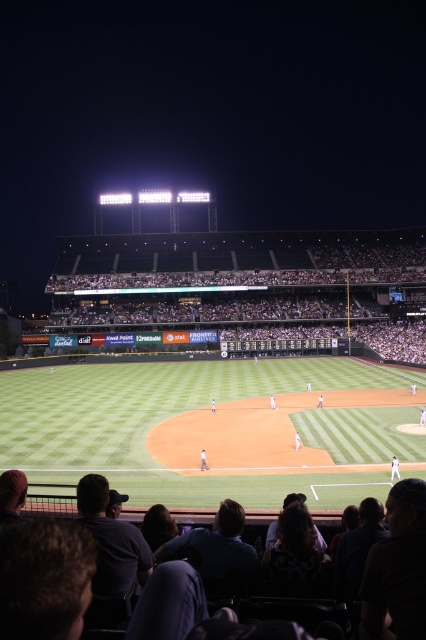
You are a photographer standing at the edge of the baseball field. You want to take a photo that includes both the dark fabric seats at lower center and the white fabric shirt at center. Based on their positions, which object should appear closer to the bottom of the photo?

The dark fabric seats at lower center are positioned above the white fabric shirt at center, so in the photo, the white fabric shirt at center will appear closer to the bottom of the photo.

You are a photographer standing at the edge of the baseball field. You want to take a photo that includes both the dark fabric seats at lower center and the white fabric shirt at center. Which object will appear taller in the photo?

The white fabric shirt at center will appear taller in the photo because the dark fabric seats at lower center has a lesser height compared to it.

You are a photographer standing in the stands of the baseball stadium. You want to take a photo of the white fabric shirt at center and the white fabric baseball player at center. Which one is positioned lower in the frame?

The white fabric shirt at center is positioned below the white fabric baseball player at center, so it is lower in the frame.